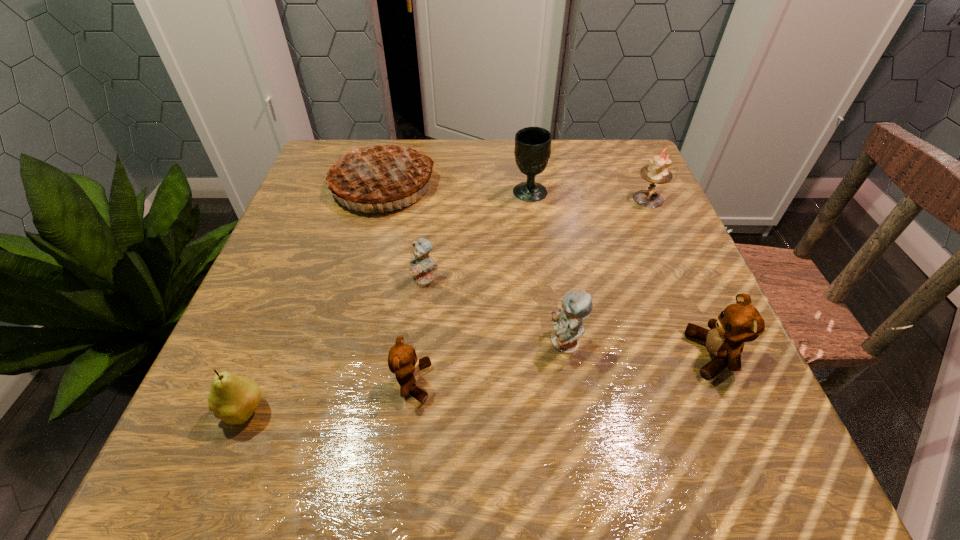
Identify the location of vacant area between the tallest object and the bigger blue teddy bear. (474, 264).

Identify the location of free space between the tallest object and the smaller brown teddy bear. (397, 284).

Image resolution: width=960 pixels, height=540 pixels. Find the location of `vacant region between the pie and the rightmost teddy bear`. vacant region between the pie and the rightmost teddy bear is located at coordinates (547, 270).

You are a GUI agent. You are given a task and a screenshot of the screen. Output one action in this format:
    pyautogui.click(x=<x>, y=<y>)
    Task: Click on the free space that is in between the chalice and the smaller blue teddy bear
    The width and height of the screenshot is (960, 540).
    Given the screenshot: What is the action you would take?
    pyautogui.click(x=477, y=235)

This screenshot has width=960, height=540. Find the location of `free spot between the right brown teddy bear and the smaller brown teddy bear`. free spot between the right brown teddy bear and the smaller brown teddy bear is located at coordinates (563, 369).

You are a GUI agent. You are given a task and a screenshot of the screen. Output one action in this format:
    pyautogui.click(x=<x>, y=<y>)
    Task: Click on the free space that is in between the bigger brown teddy bear and the pear
    The image size is (960, 540).
    Given the screenshot: What is the action you would take?
    pyautogui.click(x=478, y=383)

The image size is (960, 540). Find the location of `blank region between the chalice and the right brown teddy bear`. blank region between the chalice and the right brown teddy bear is located at coordinates (621, 274).

Find the location of a particular element. This screenshot has width=960, height=540. free space between the tallest object and the chalice is located at coordinates (456, 188).

Locate an element on the screen. the closest object relative to the pear is located at coordinates (402, 361).

Image resolution: width=960 pixels, height=540 pixels. What are the coordinates of `object that is the seventh closest to the right blue teddy bear` in the screenshot? It's located at (233, 399).